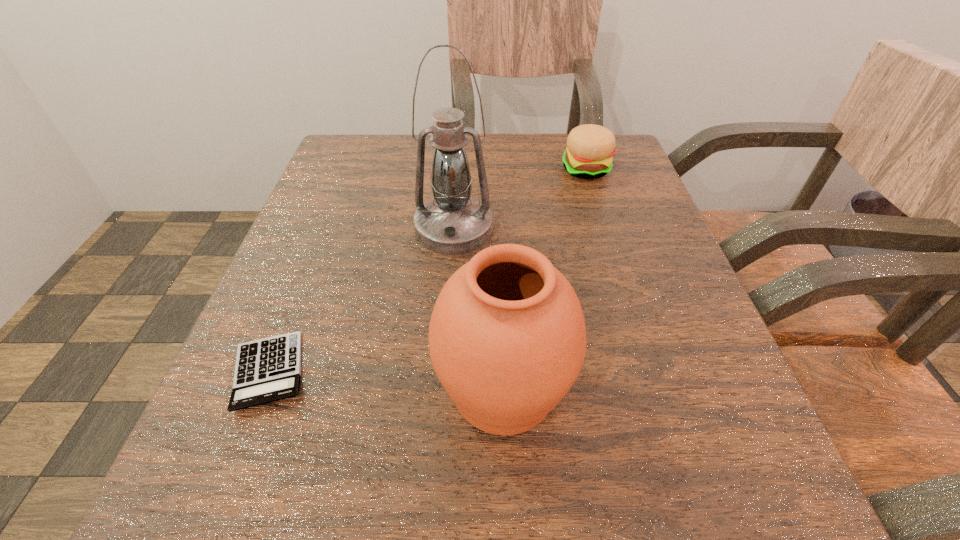
Find the location of a particular element. The width and height of the screenshot is (960, 540). free location that satisfies the following two spatial constraints: 1. on the back side of the oil lamp; 2. on the left side of the shortest object is located at coordinates (324, 229).

Find the location of a particular element. vacant space that satisfies the following two spatial constraints: 1. on the back side of the leftmost object; 2. on the right side of the second farthest object is located at coordinates (324, 229).

Locate an element on the screen. free space that satisfies the following two spatial constraints: 1. on the front side of the second tallest object; 2. on the right side of the leftmost object is located at coordinates (261, 389).

In order to click on free space that satisfies the following two spatial constraints: 1. on the back side of the second tallest object; 2. on the right side of the third tallest object in this screenshot , I will do `click(493, 170)`.

The height and width of the screenshot is (540, 960). Identify the location of vacant point that satisfies the following two spatial constraints: 1. on the back side of the urn; 2. on the right side of the hamburger. (493, 170).